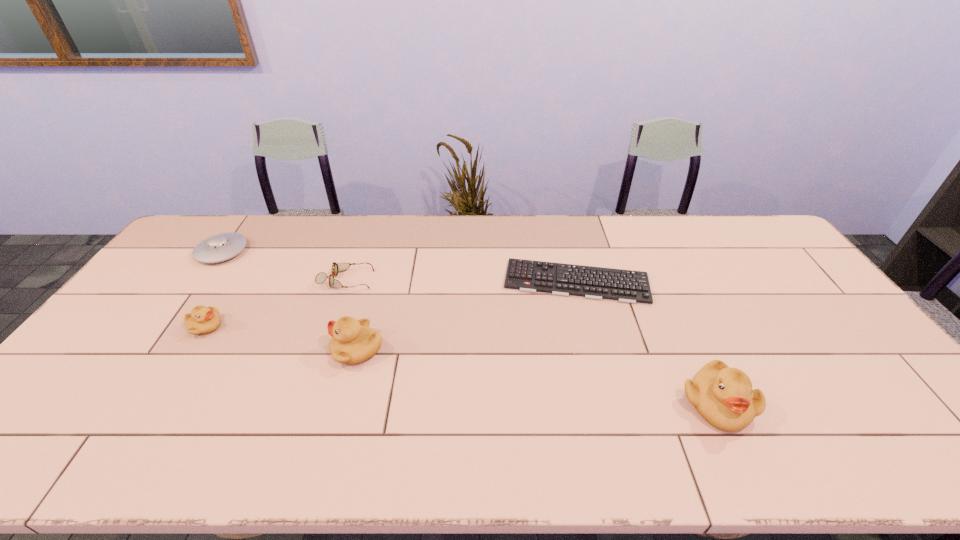
Where is `the third tallest object`? The width and height of the screenshot is (960, 540). the third tallest object is located at coordinates (202, 320).

The height and width of the screenshot is (540, 960). Identify the location of the shortest duckling. (202, 320).

The image size is (960, 540). Identify the location of the second duckling from right to left. (353, 341).

Where is `the second tallest duckling`? the second tallest duckling is located at coordinates (353, 341).

Locate an element on the screen. The width and height of the screenshot is (960, 540). the rightmost duckling is located at coordinates (723, 396).

This screenshot has width=960, height=540. Find the location of `the nearest duckling`. the nearest duckling is located at coordinates (723, 396).

Where is `the third shortest object`? The image size is (960, 540). the third shortest object is located at coordinates (220, 247).

The image size is (960, 540). I want to click on computer keyboard, so click(627, 286).

In order to click on spectacles in this screenshot , I will do `click(336, 267)`.

Locate an element on the screen. This screenshot has width=960, height=540. free space located on the front-facing side of the leftmost duckling is located at coordinates (275, 327).